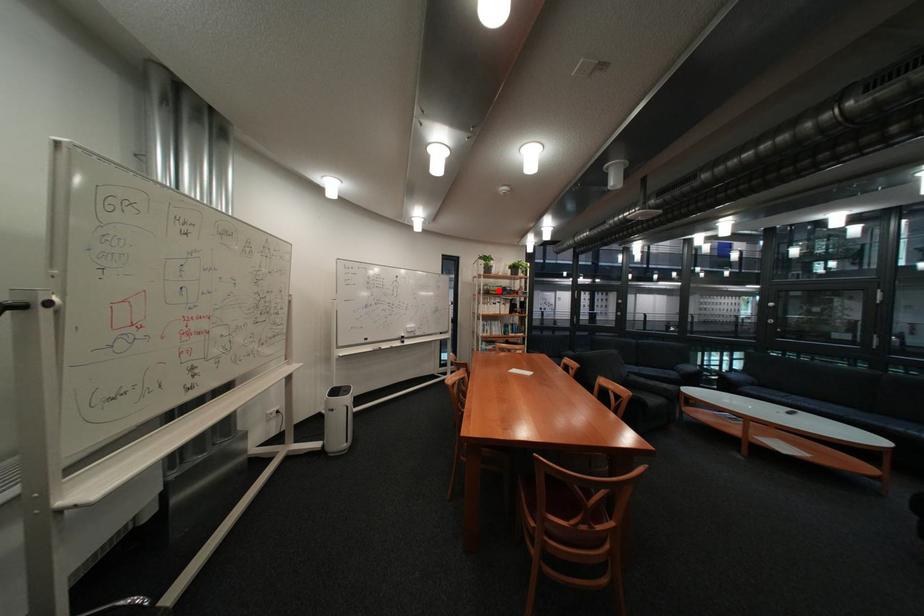
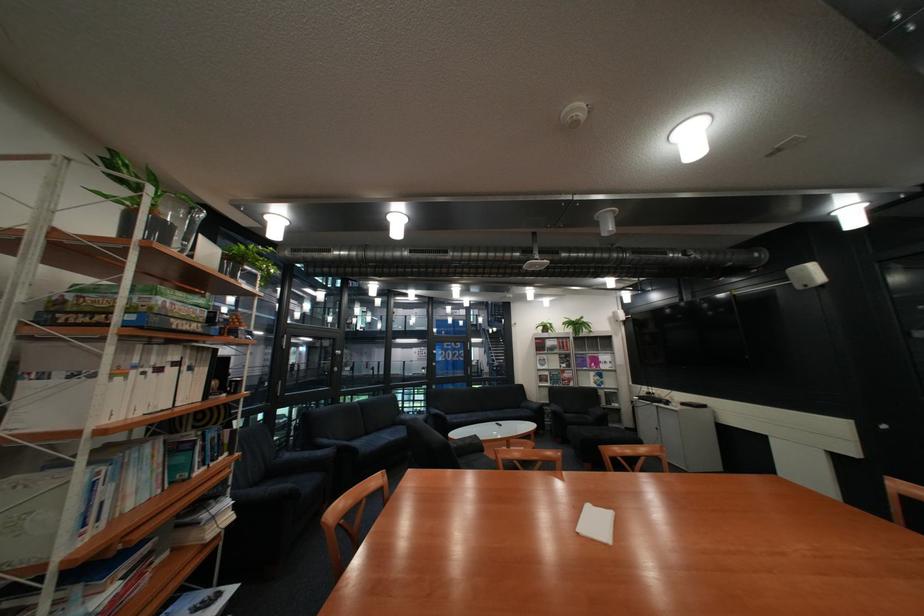
The point at the highlighted location is marked in the first image. Where is the corresponding point in the second image?

(141, 312)